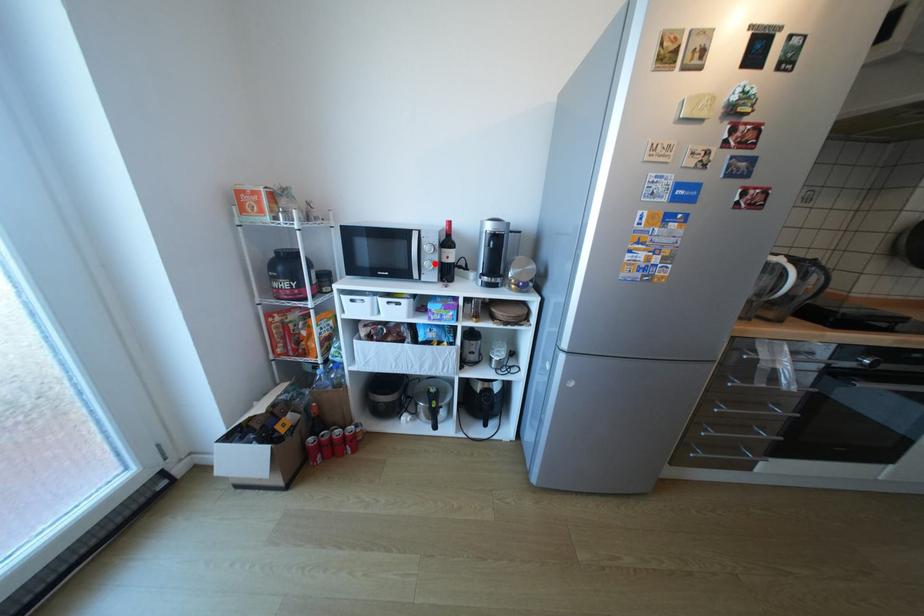
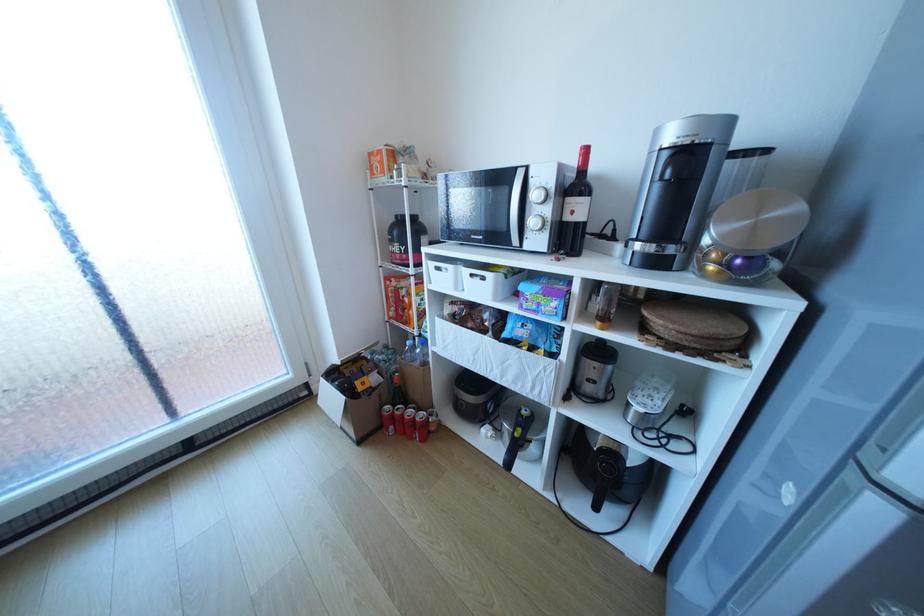
Locate, in the second image, the point that corresponds to the highlighted location in the first image.

(541, 222)